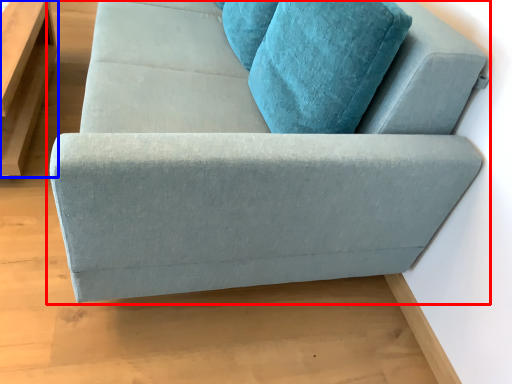
Question: Which object appears closest to the camera in this image, studio couch (highlighted by a red box) or table (highlighted by a blue box)?

Choices:
 (A) studio couch
 (B) table

Answer: (A)